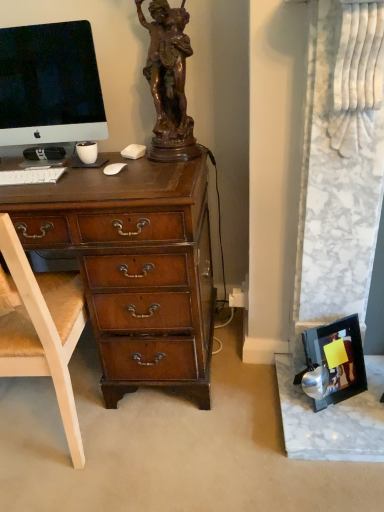
Identify the location of satin black monitor at upper left. (49, 85).

Locate an element on the screen. white wood chair at left is located at coordinates (42, 329).

What do you see at coordinates (31, 176) in the screenshot? I see `white matte keyboard at left` at bounding box center [31, 176].

In order to click on satin black monitor at upper left in this screenshot , I will do `click(49, 85)`.

Is satin black monitor at upper left smaller than white wood chair at left?

Correct, satin black monitor at upper left occupies less space than white wood chair at left.

Considering the sizes of satin black monitor at upper left and white wood chair at left in the image, is satin black monitor at upper left taller or shorter than white wood chair at left?

In the image, satin black monitor at upper left appears to be shorter than white wood chair at left.

Is satin black monitor at upper left inside the boundaries of white wood chair at left, or outside?

satin black monitor at upper left is not enclosed by white wood chair at left.

Would you say satin black monitor at upper left is to the left or to the right of white wood chair at left in the picture?

Clearly, satin black monitor at upper left is on the right of white wood chair at left in the image.

How many degrees apart are the facing directions of white wood chair at left and satin black monitor at upper left?

The angular difference between white wood chair at left and satin black monitor at upper left is 180 degrees.

Is white wood chair at left oriented towards satin black monitor at upper left?

No, white wood chair at left is not turned towards satin black monitor at upper left.

Consider the image. From a real-world perspective, between white wood chair at left and satin black monitor at upper left, who is vertically lower?

In real-world perspective, white wood chair at left is lower.

Considering the relative sizes of white matte keyboard at left and metallic silver picture frame at lower right in the image provided, is white matte keyboard at left wider than metallic silver picture frame at lower right?

No.

Is point (5, 172) closer to viewer compared to point (333, 331)?

That is False.

How far apart are white matte keyboard at left and metallic silver picture frame at lower right?

They are 3.43 feet apart.

Is white matte keyboard at left inside the boundaries of metallic silver picture frame at lower right, or outside?

white matte keyboard at left is outside metallic silver picture frame at lower right.

Is metallic silver picture frame at lower right at the back of white plastic power outlet at lower center?

No, white plastic power outlet at lower center's orientation is not away from metallic silver picture frame at lower right.

Considering the relative sizes of white plastic power outlet at lower center and metallic silver picture frame at lower right in the image provided, is white plastic power outlet at lower center shorter than metallic silver picture frame at lower right?

Indeed, white plastic power outlet at lower center has a lesser height compared to metallic silver picture frame at lower right.

Locate an element on the screen. The height and width of the screenshot is (512, 384). power outlet above the metallic silver picture frame at lower right (from the image's perspective) is located at coordinates (238, 297).

From a real-world perspective, between white plastic power outlet at lower center and metallic silver picture frame at lower right, who is vertically lower?

In real-world perspective, metallic silver picture frame at lower right is lower.

From a real-world perspective, relative to white matte keyboard at left, is metallic silver picture frame at lower right vertically above or below?

metallic silver picture frame at lower right is below white matte keyboard at left.

Is point (331, 337) positioned after point (51, 179)?

Yes.

Who is shorter, metallic silver picture frame at lower right or white matte keyboard at left?

With less height is white matte keyboard at left.

Is white plastic power outlet at lower center completely or partially inside white wood chair at left?

That's incorrect, white plastic power outlet at lower center is not inside white wood chair at left.

Considering the positions of objects white wood chair at left and white plastic power outlet at lower center in the image provided, who is behind, white wood chair at left or white plastic power outlet at lower center?

white plastic power outlet at lower center is more distant.

From the image's perspective, does white wood chair at left appear higher than white plastic power outlet at lower center?

No, from the image's perspective, white wood chair at left is not over white plastic power outlet at lower center.

Between white wood chair at left and white plastic power outlet at lower center, which one has larger size?

white wood chair at left is bigger.

Is white matte keyboard at left facing away from satin black monitor at upper left?

Yes.

Would you say white matte keyboard at left is inside or outside satin black monitor at upper left?

The correct answer is: outside.

From the image's perspective, is white matte keyboard at left positioned above or below satin black monitor at upper left?

white matte keyboard at left is situated lower than satin black monitor at upper left in the image.

Is point (1, 178) positioned after point (36, 87)?

No, it is in front of (36, 87).

Where is `computer monitor above the white wood chair at left (from a real-world perspective)`? The height and width of the screenshot is (512, 384). computer monitor above the white wood chair at left (from a real-world perspective) is located at coordinates (49, 85).

Locate an element on the screen. This screenshot has height=512, width=384. computer monitor lying behind the white wood chair at left is located at coordinates (49, 85).

Which object lies nearer to the anchor point satin black monitor at upper left, metallic silver picture frame at lower right or white plastic power outlet at lower center?

white plastic power outlet at lower center lies closer to satin black monitor at upper left than the other object.

Estimate the real-world distances between objects in this image. Which object is closer to satin black monitor at upper left, white plastic power outlet at lower center or metallic silver picture frame at lower right?

white plastic power outlet at lower center is positioned closer to the anchor satin black monitor at upper left.

From the image, which object appears to be nearer to white plastic power outlet at lower center, satin black monitor at upper left or white matte keyboard at left?

white matte keyboard at left lies closer to white plastic power outlet at lower center than the other object.

When comparing their distances from white plastic power outlet at lower center, does white matte keyboard at left or satin black monitor at upper left seem further?

Based on the image, satin black monitor at upper left appears to be further to white plastic power outlet at lower center.

From the image, which object appears to be farther from satin black monitor at upper left, white plastic power outlet at lower center or white matte keyboard at left?

white plastic power outlet at lower center.

From the image, which object appears to be farther from white wood chair at left, metallic silver picture frame at lower right or white matte keyboard at left?

metallic silver picture frame at lower right is further to white wood chair at left.

Considering their positions, is white wood chair at left positioned further to white plastic power outlet at lower center than metallic silver picture frame at lower right?

Based on the image, white wood chair at left appears to be further to white plastic power outlet at lower center.

Considering their positions, is white plastic power outlet at lower center positioned further to metallic silver picture frame at lower right than white wood chair at left?

white wood chair at left.

Where is `chair between white matte keyboard at left and white plastic power outlet at lower center in the horizontal direction`? chair between white matte keyboard at left and white plastic power outlet at lower center in the horizontal direction is located at coordinates (42, 329).

Where is `computer monitor located between white matte keyboard at left and metallic silver picture frame at lower right in the left-right direction`? computer monitor located between white matte keyboard at left and metallic silver picture frame at lower right in the left-right direction is located at coordinates (49, 85).

Locate an element on the screen. computer monitor between white matte keyboard at left and white plastic power outlet at lower center from left to right is located at coordinates pos(49,85).

The image size is (384, 512). I want to click on computer keyboard between satin black monitor at upper left and white wood chair at left in the up-down direction, so click(x=31, y=176).